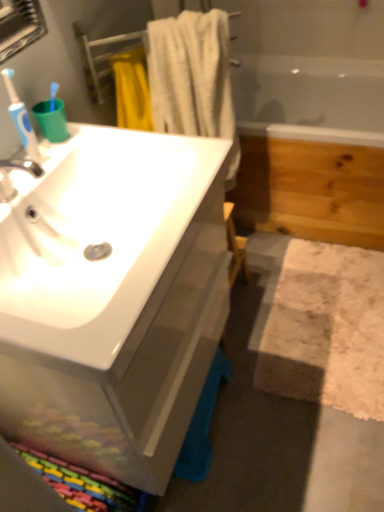
This screenshot has height=512, width=384. Identify the location of vacant space situated above white textured bath mat at lower right (from a real-world perspective). (335, 314).